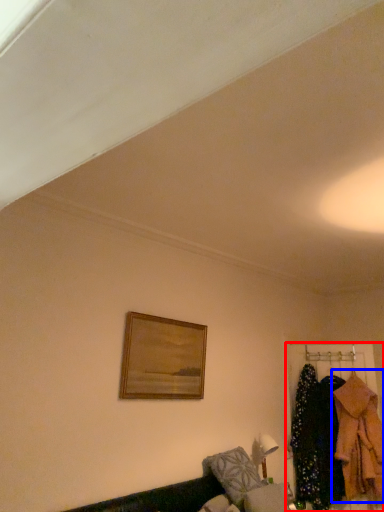
Question: Which object is closer to the camera taking this photo, closet (highlighted by a red box) or clothing (highlighted by a blue box)?

Choices:
 (A) closet
 (B) clothing

Answer: (B)